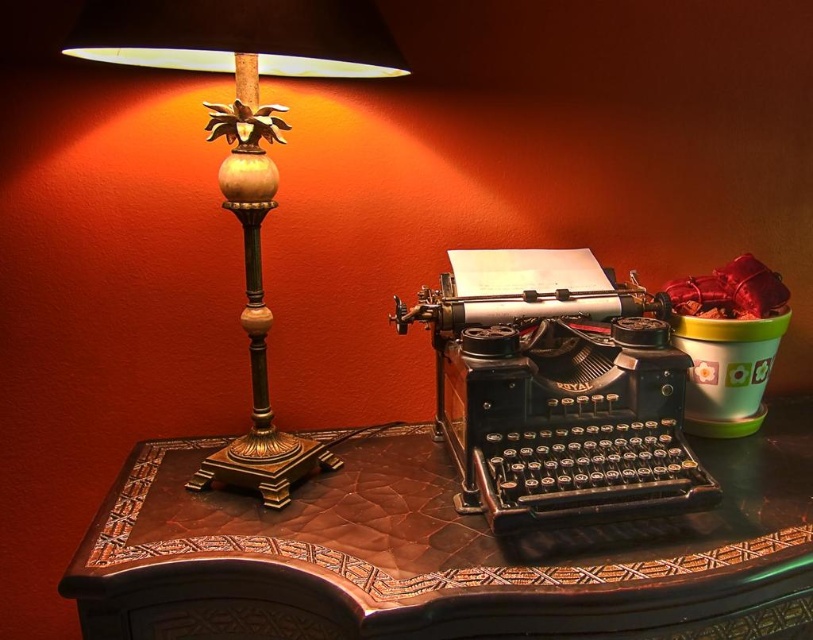
Question: Among these points, which one is nearest to the camera?

Choices:
 (A) (364, 520)
 (B) (311, 76)

Answer: (A)

Question: Does brown leather table at center appear under gold-bronze table lamp at left?

Choices:
 (A) yes
 (B) no

Answer: (A)

Question: Does brown leather table at center have a smaller size compared to gold-bronze table lamp at left?

Choices:
 (A) yes
 (B) no

Answer: (B)

Question: Which point is farther to the camera?

Choices:
 (A) gold-bronze table lamp at left
 (B) brown leather table at center

Answer: (A)

Question: Which point is farther to the camera?

Choices:
 (A) (150, 22)
 (B) (392, 627)

Answer: (A)

Question: From the image, what is the correct spatial relationship of brown leather table at center in relation to gold-bronze table lamp at left?

Choices:
 (A) left
 (B) right

Answer: (B)